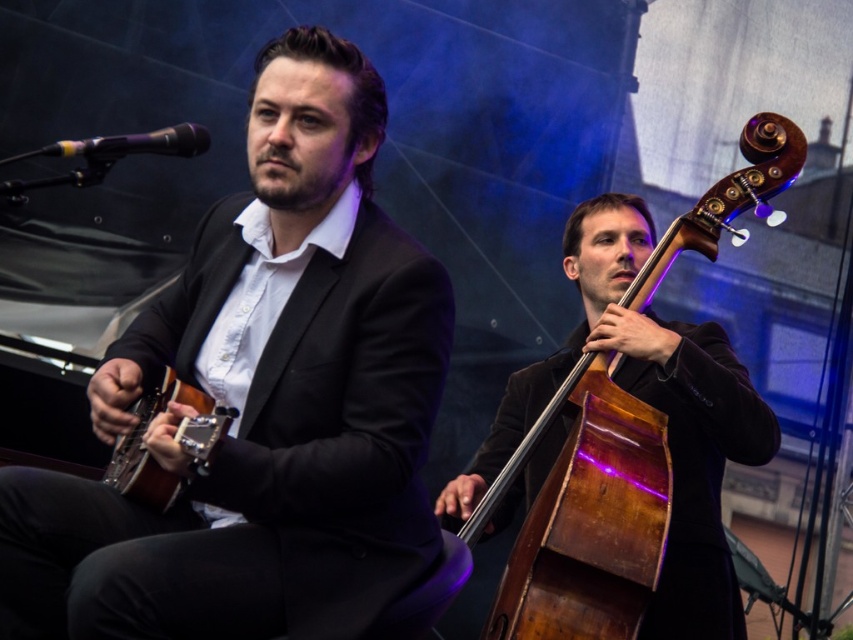
Question: Is matte black suit at center below wooden polished cello at right?

Choices:
 (A) yes
 (B) no

Answer: (B)

Question: Is matte black suit at center closer to the viewer compared to wooden polished cello at right?

Choices:
 (A) yes
 (B) no

Answer: (A)

Question: Can you confirm if matte black suit at center is positioned to the right of wooden polished cello at right?

Choices:
 (A) no
 (B) yes

Answer: (A)

Question: Among these points, which one is farthest from the camera?

Choices:
 (A) [x=274, y=250]
 (B) [x=650, y=522]

Answer: (B)